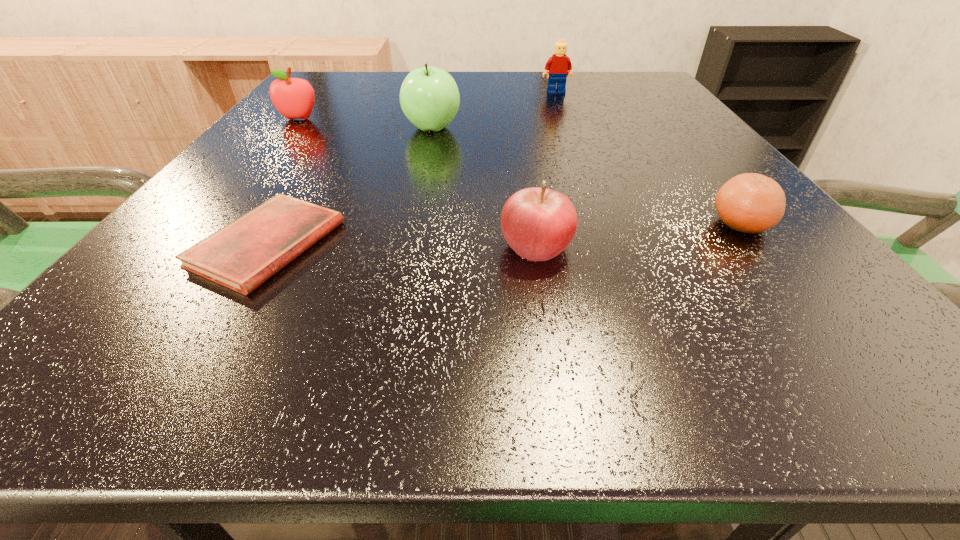
Find the location of `vacant position located on the front-facing side of the second object from right to left`. vacant position located on the front-facing side of the second object from right to left is located at coordinates tap(586, 168).

Find the location of a particular element. This screenshot has width=960, height=540. free location located 0.280m on the back of the leftmost apple is located at coordinates (336, 73).

The height and width of the screenshot is (540, 960). I want to click on vacant space situated on the left of the third object from right to left, so click(x=380, y=246).

At what (x,y) coordinates should I click in order to perform the action: click on vacant space located on the back of the rightmost object. Please return your answer as a coordinate pair (x, y). The image size is (960, 540). Looking at the image, I should click on (711, 187).

At what (x,y) coordinates should I click in order to perform the action: click on free space located on the right of the diary. Please return your answer as a coordinate pair (x, y). The height and width of the screenshot is (540, 960). Looking at the image, I should click on (535, 244).

In order to click on object situated at the far edge in this screenshot , I will do `click(559, 64)`.

The image size is (960, 540). I want to click on apple present at the left edge, so click(294, 98).

The image size is (960, 540). I want to click on diary situated at the left edge, so click(x=242, y=255).

Locate an element on the screen. The width and height of the screenshot is (960, 540). object positioned at the right edge is located at coordinates (752, 203).

Identify the location of free location at the far edge. The width and height of the screenshot is (960, 540). (472, 91).